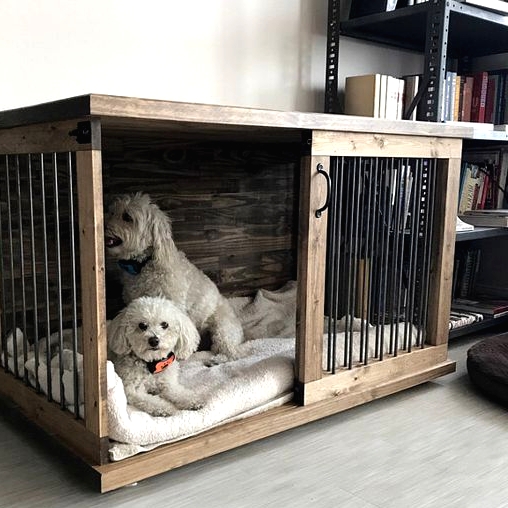
The height and width of the screenshot is (508, 508). Identify the location of dog bed. (499, 364).